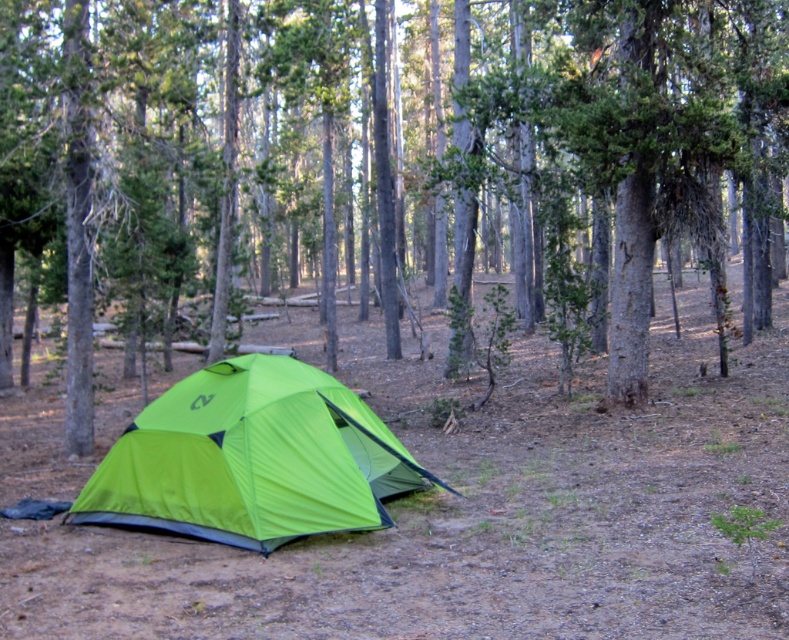
You are standing at point (184, 512) and want to walk to the bright lime green tent in the foreground. Is the point (600, 192) between you and the tent?

Point (600, 192) is behind point (184, 512), so the point (600, 192) is not between you and the tent. You can walk directly to the tent without obstruction from point (600, 192).